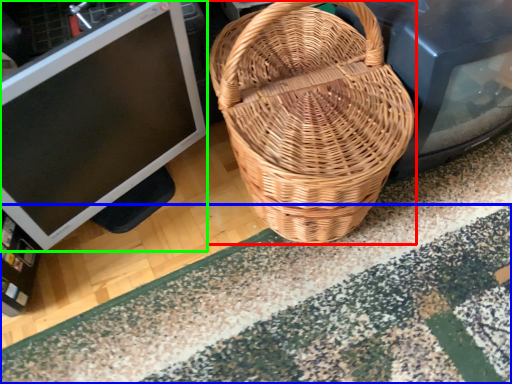
Question: Considering the real-world distances, which object is closest to picnic basket (highlighted by a red box)? doormat (highlighted by a blue box) or computer monitor (highlighted by a green box).

Choices:
 (A) doormat
 (B) computer monitor

Answer: (B)